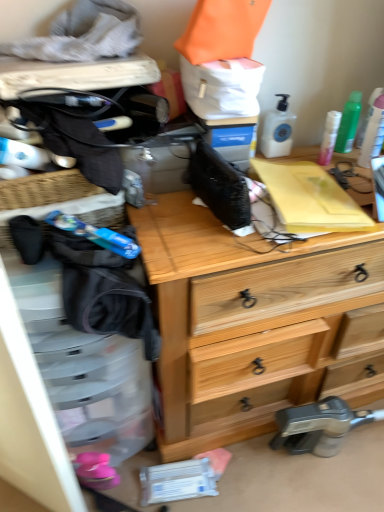
This screenshot has width=384, height=512. What are the coordinates of `blank space to the left of green matte spray can at upper right, the second toiletry when ordered from right to left` in the screenshot? It's located at (307, 152).